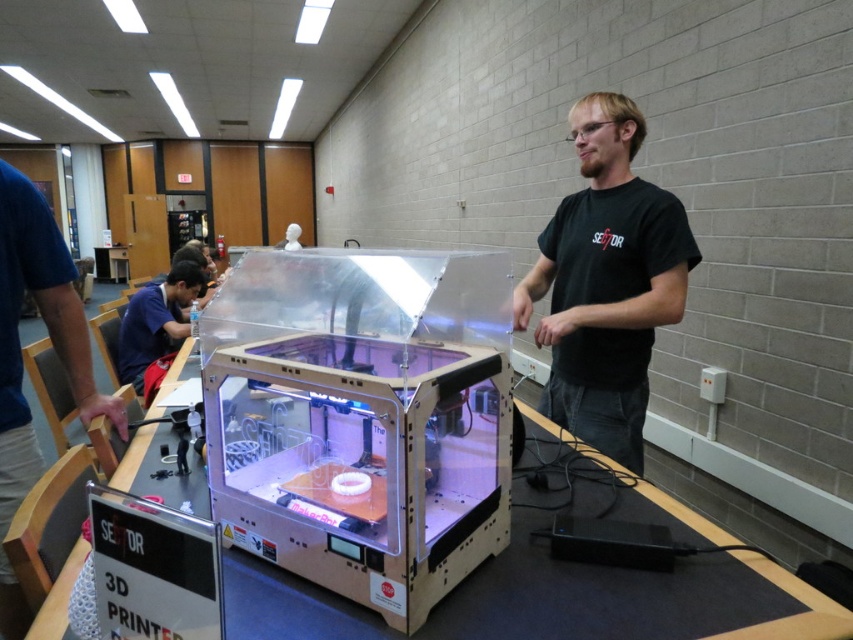
Question: Which object is farther from the camera taking this photo?

Choices:
 (A) black matte shirt at center
 (B) matte blue shirt at left
 (C) blue fabric shirt at left

Answer: (B)

Question: Is the position of blue fabric shirt at left more distant than that of matte blue shirt at left?

Choices:
 (A) yes
 (B) no

Answer: (B)

Question: Which point is closer to the camera taking this photo?

Choices:
 (A) (637, 269)
 (B) (155, 285)
 (C) (73, 324)

Answer: (C)

Question: Is black matte shirt at center further to camera compared to blue fabric shirt at left?

Choices:
 (A) yes
 (B) no

Answer: (A)

Question: Among these objects, which one is farthest from the camera?

Choices:
 (A) blue fabric shirt at left
 (B) matte blue shirt at left

Answer: (B)

Question: Can you confirm if blue fabric shirt at left is thinner than matte blue shirt at left?

Choices:
 (A) yes
 (B) no

Answer: (A)